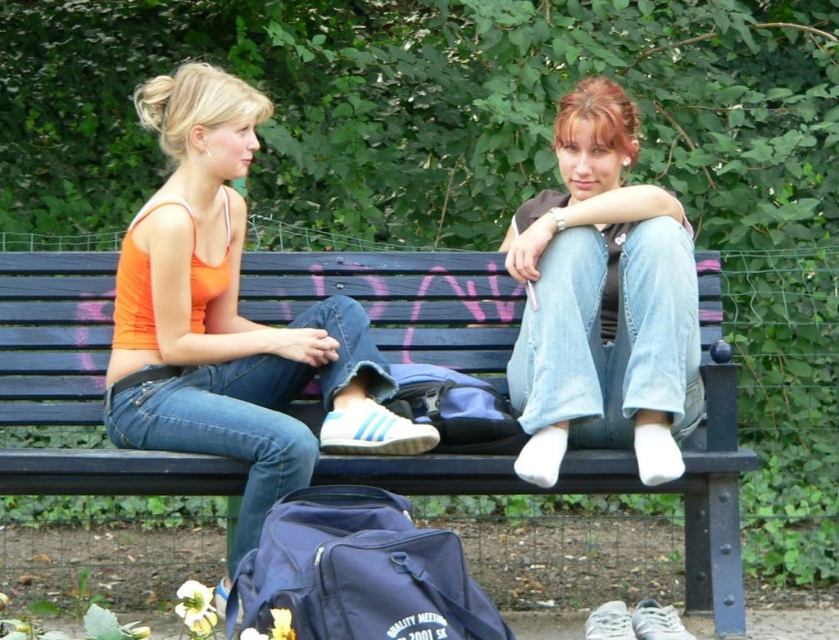
You are standing in a park and want to take a photo of the scene. You notice a specific point at coordinates point (621,461). If your camera can focus on objects within 3 meters, will it be able to clearly capture that point?

The distance of point (621,461) from camera is 3.67 meters, so the camera cannot focus on it clearly since it is beyond the 3 meter range.

You are designing a new outdoor seating area and want to ensure there is enough space for both the black wood bench at center and the orange fabric tank top at left. Based on the image, which object takes up more space?

The orange fabric tank top at left occupies more space than the black wood bench at center according to the description.